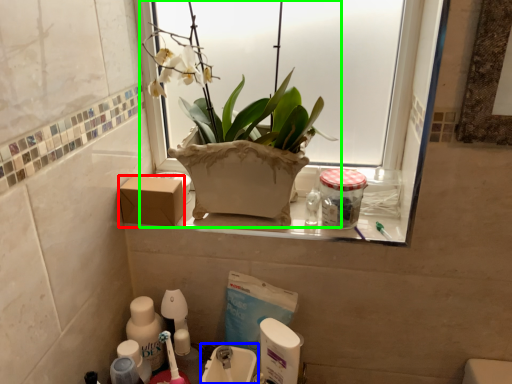
Question: Based on their relative distances, which object is farther from cardboard box (highlighted by a red box)? Choose from sink (highlighted by a blue box) and houseplant (highlighted by a green box).

Choices:
 (A) sink
 (B) houseplant

Answer: (A)